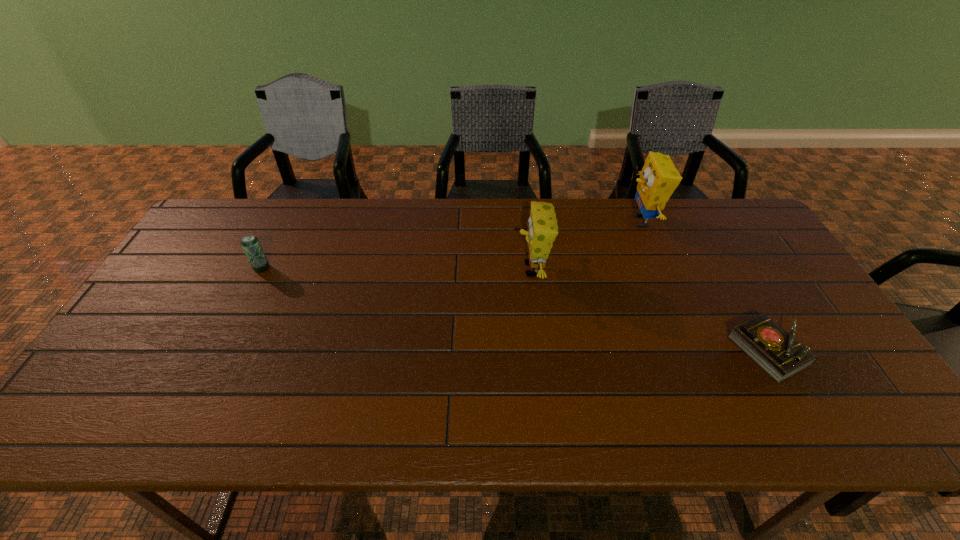
Find the location of a particular element. Image resolution: width=960 pixels, height=540 pixels. free space that is in between the rightmost object and the leftmost object is located at coordinates (515, 309).

Identify which object is located as the nearest to the leftmost object. Please provide its 2D coordinates. Your answer should be formatted as a tuple, i.e. [(x, y)], where the tuple contains the x and y coordinates of a point satisfying the conditions above.

[(543, 229)]

Find the location of `the third closest object to the rightmost object`. the third closest object to the rightmost object is located at coordinates (250, 243).

Where is `free space that satisfies the following two spatial constraints: 1. on the face of the second object from right to left; 2. on the right side of the rightmost object`? Image resolution: width=960 pixels, height=540 pixels. free space that satisfies the following two spatial constraints: 1. on the face of the second object from right to left; 2. on the right side of the rightmost object is located at coordinates (695, 351).

Where is `vacant region that satisfies the following two spatial constraints: 1. on the face of the shortest object; 2. on the left side of the third object from left to right`? The width and height of the screenshot is (960, 540). vacant region that satisfies the following two spatial constraints: 1. on the face of the shortest object; 2. on the left side of the third object from left to right is located at coordinates (695, 351).

The image size is (960, 540). Identify the location of blank area in the image that satisfies the following two spatial constraints: 1. on the face of the right sponge; 2. on the right side of the nearest object. (695, 351).

Where is `free space that satisfies the following two spatial constraints: 1. on the back side of the diary; 2. on the face of the second object from right to left`? Image resolution: width=960 pixels, height=540 pixels. free space that satisfies the following two spatial constraints: 1. on the back side of the diary; 2. on the face of the second object from right to left is located at coordinates (696, 221).

What are the coordinates of `free point that satisfies the following two spatial constraints: 1. on the face of the left sponge; 2. on the left side of the diary` in the screenshot? It's located at (542, 351).